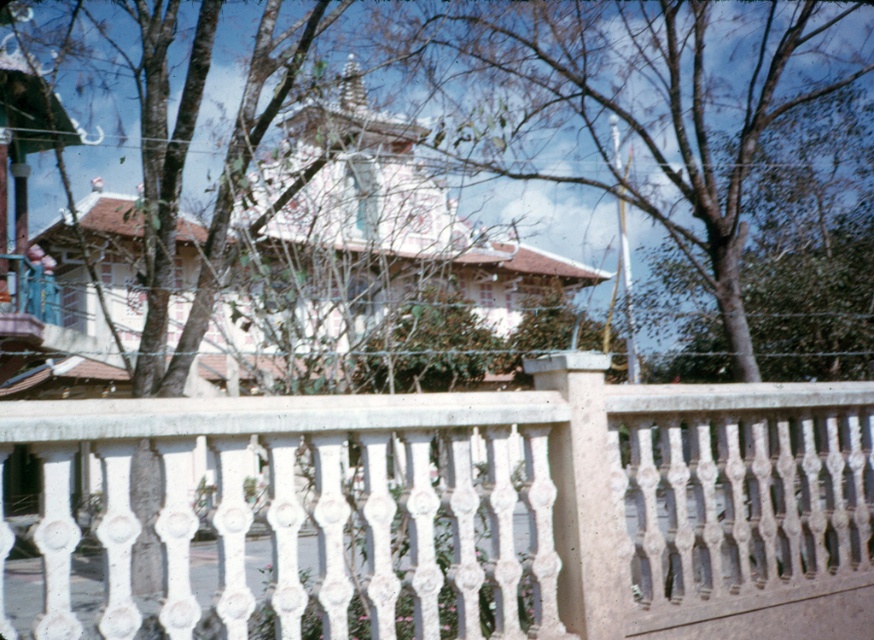
Question: Which of the following is the closest to the observer?

Choices:
 (A) white stone fence at center
 (B) brown leafy tree at center

Answer: (A)

Question: Is white stone fence at center to the left of brown leafy tree at center from the viewer's perspective?

Choices:
 (A) yes
 (B) no

Answer: (A)

Question: Which point is closer to the camera taking this photo?

Choices:
 (A) (670, 40)
 (B) (727, 429)

Answer: (B)

Question: Does white stone fence at center have a lesser width compared to brown leafy tree at center?

Choices:
 (A) yes
 (B) no

Answer: (B)

Question: Where is white stone fence at center located in relation to brown leafy tree at center in the image?

Choices:
 (A) right
 (B) left

Answer: (B)

Question: Which point is farther to the camera?

Choices:
 (A) white stone fence at center
 (B) brown leafy tree at center

Answer: (B)